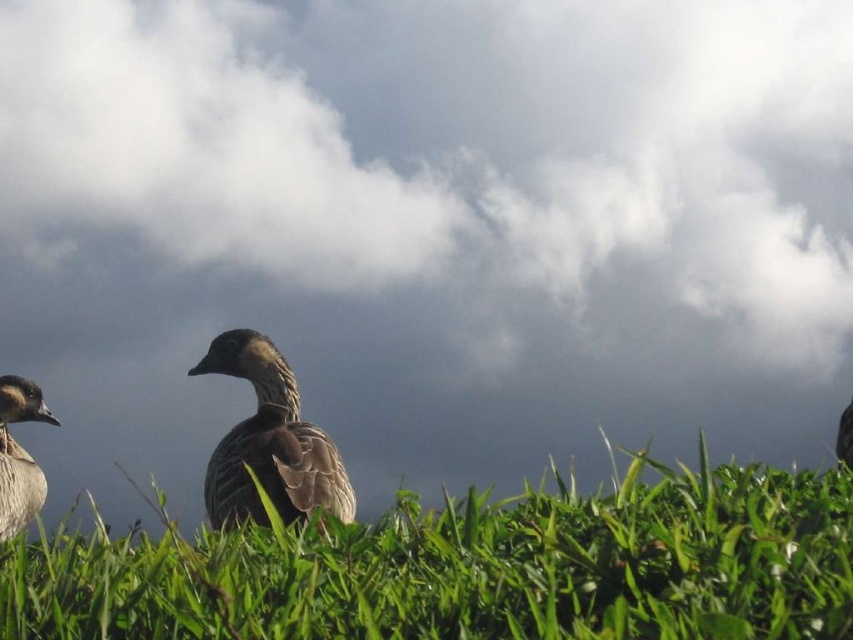
Does point (218, 348) come closer to viewer compared to point (24, 400)?

Yes, it is.

Is brown feathered duck at center shorter than brown feathered duck at left?

Correct, brown feathered duck at center is not as tall as brown feathered duck at left.

Where is `brown feathered duck at center`? brown feathered duck at center is located at coordinates [x=270, y=444].

Is point (128, 550) positioned after point (248, 451)?

That is False.

Looking at this image, measure the distance from green grassy at center to brown feathered duck at center.

green grassy at center is 9.55 feet away from brown feathered duck at center.

Is point (607, 605) positioned behind point (239, 340)?

No, it is not.

You are a GUI agent. You are given a task and a screenshot of the screen. Output one action in this format:
    pyautogui.click(x=<x>, y=<y>)
    Task: Click on the green grassy at center
    This screenshot has height=640, width=853.
    Given the screenshot: What is the action you would take?
    pyautogui.click(x=473, y=568)

Does green grassy at center have a larger size compared to brown feathered duck at left?

Yes.

What do you see at coordinates (473, 568) in the screenshot?
I see `green grassy at center` at bounding box center [473, 568].

Identify the location of green grassy at center. The height and width of the screenshot is (640, 853). (473, 568).